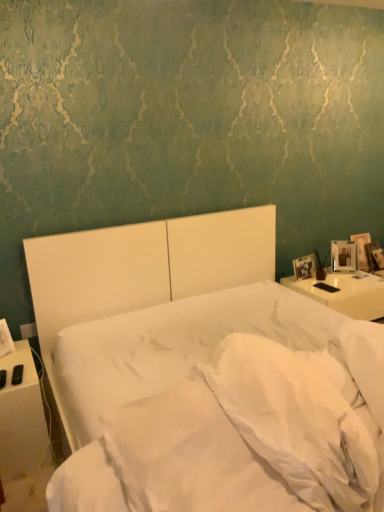
I want to click on blank space situated above white glossy nightstand at right, marked as the 2th nightstand in a front-to-back arrangement (from a real-world perspective), so click(322, 278).